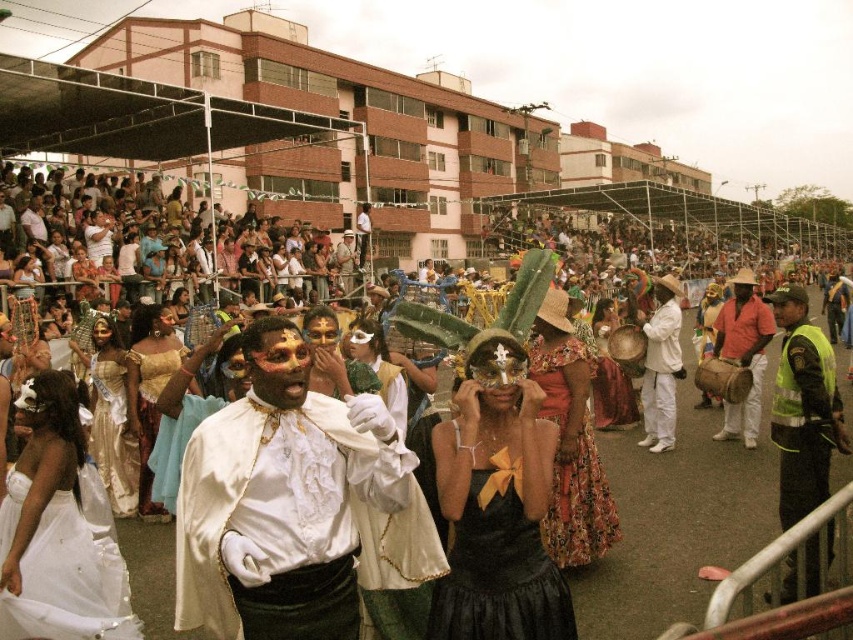
You are a costume designer analyzing the costumes in the festival scene. Which of the two central items, the white satin cape at center or the orange cotton shirt at center, has a smaller width?

The white satin cape at center has a smaller width than the orange cotton shirt at center according to the description.

You are a photographer at the festival and want to capture a photo where both the white matte pants at center and the matte gold mask at center are visible. Which object should you focus on to ensure both are in the frame?

You should focus on the white matte pants at center because it is closer to the viewer than the matte gold mask at center, so keeping it in focus will help both objects appear sharp in the photo.

You are a photographer at the festival and want to capture both the white satin cape at center and the orange cotton shirt at center in a single photo. Which object should you focus on first to ensure both are in frame?

The white satin cape at center is positioned on the left side of orange cotton shirt at center, so you should focus on the orange cotton shirt at center first to ensure both are in frame.